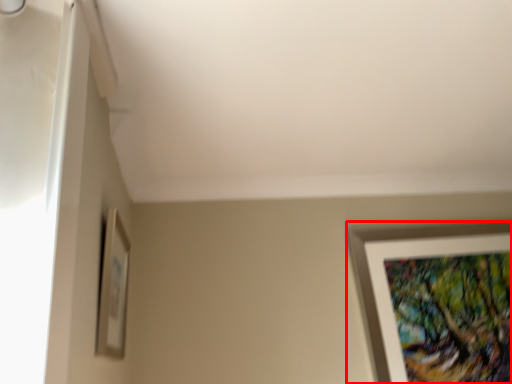
Question: Observing the image, what is the correct spatial positioning of picture frame (annotated by the red box) in reference to picture frame?

Choices:
 (A) right
 (B) left

Answer: (A)